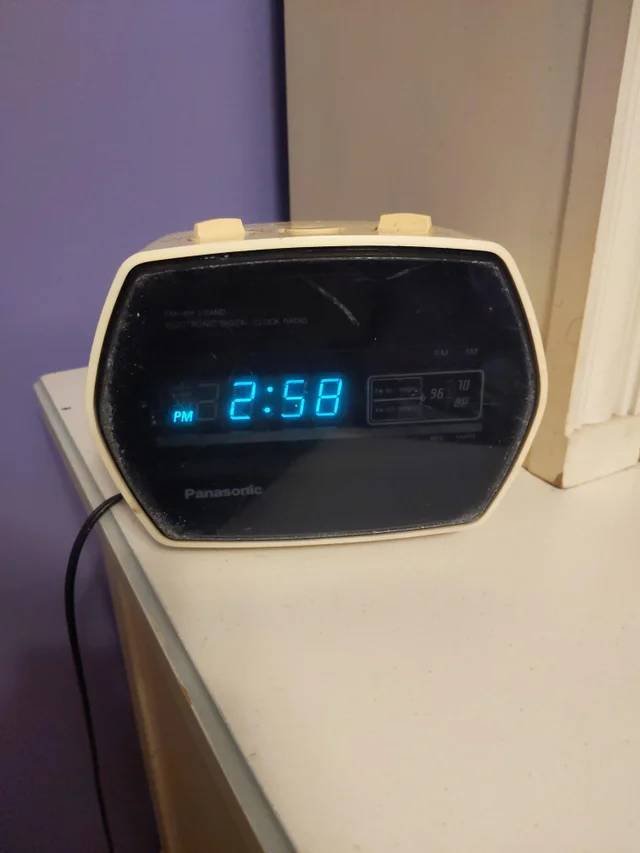
Identify the location of brandtable top. This screenshot has height=853, width=640. (217, 492), (434, 635).